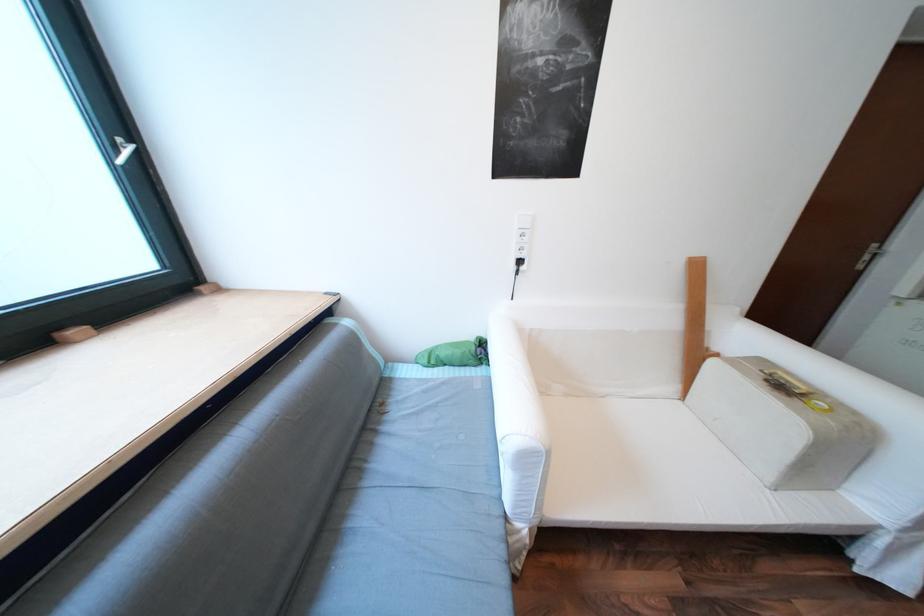
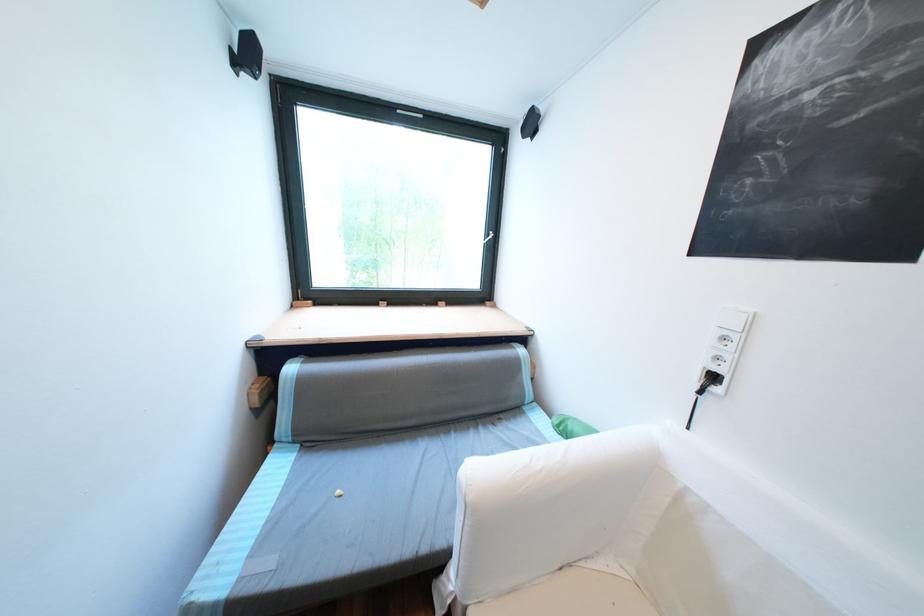
Where in the second image is the point corresponding to (455,365) from the first image?

(578, 440)